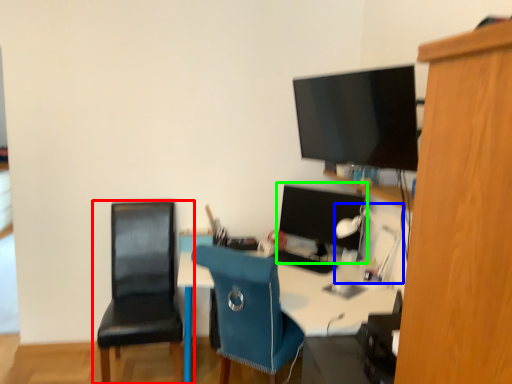
Question: Which is nearer to the chair (highlighted by a red box)? lamp (highlighted by a blue box) or computer monitor (highlighted by a green box).

Choices:
 (A) lamp
 (B) computer monitor

Answer: (B)